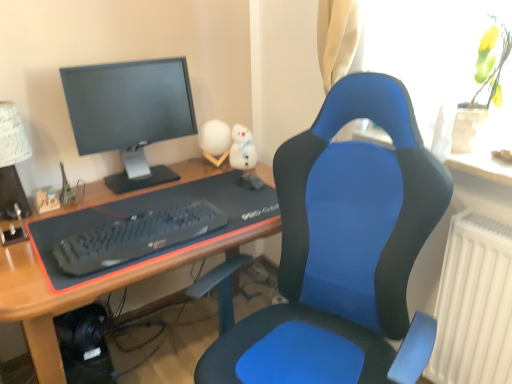
This screenshot has width=512, height=384. I want to click on vacant space situated above blue fabric desk at center (from a real-world perspective), so click(x=143, y=200).